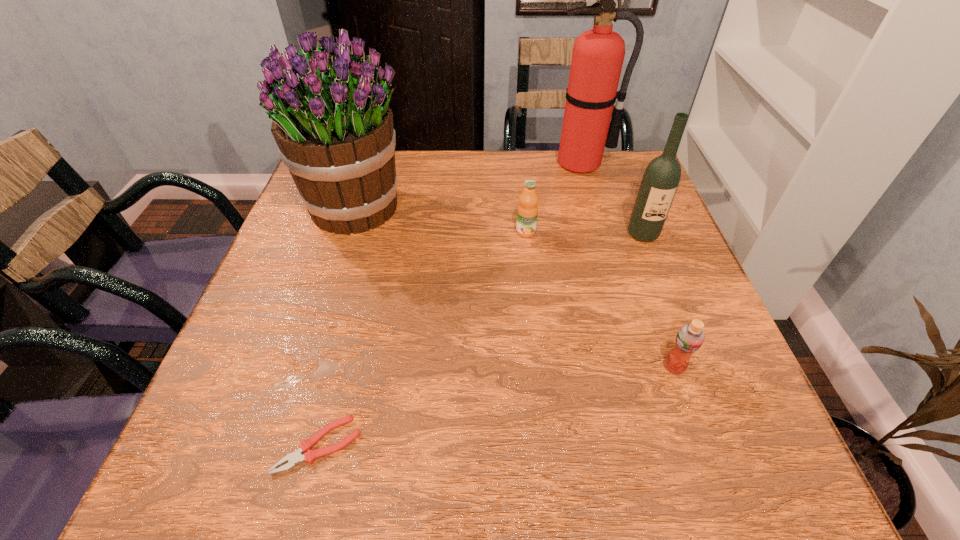
Identify the location of free space located on the right of the bouquet. This screenshot has height=540, width=960. 553,208.

Image resolution: width=960 pixels, height=540 pixels. I want to click on free space located 0.240m on the labeled side of the wine bottle, so click(680, 327).

Where is `vacant space situated 0.300m on the label of the farther orange juice`? vacant space situated 0.300m on the label of the farther orange juice is located at coordinates (539, 343).

In order to click on vacant space positioned on the left of the nearer orange juice in this screenshot , I will do `click(473, 367)`.

You are a GUI agent. You are given a task and a screenshot of the screen. Output one action in this format:
    pyautogui.click(x=<x>, y=<y>)
    Task: Click on the free space located on the back of the pliers
    
    Given the screenshot: What is the action you would take?
    pyautogui.click(x=349, y=326)

Identify the location of fire extinguisher that is at the far edge. The width and height of the screenshot is (960, 540). (598, 54).

Locate an element on the screen. The height and width of the screenshot is (540, 960). bouquet that is at the far edge is located at coordinates [331, 120].

Identify the location of object at the near edge. This screenshot has height=540, width=960. (309, 456).

Identify the location of bouquet at the left edge. (331, 120).

The width and height of the screenshot is (960, 540). What are the coordinates of `pliers that is at the left edge` in the screenshot? It's located at (309, 456).